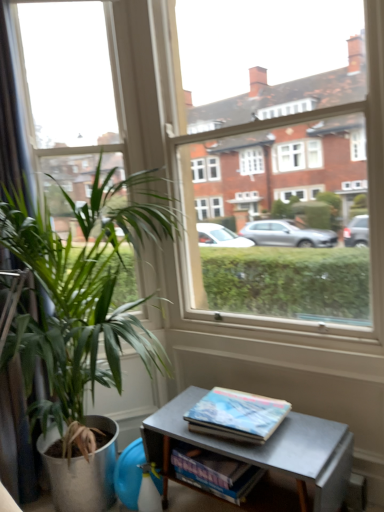
The height and width of the screenshot is (512, 384). I want to click on free spot above hardcover book at lower right (from a real-world perspective), so (236, 405).